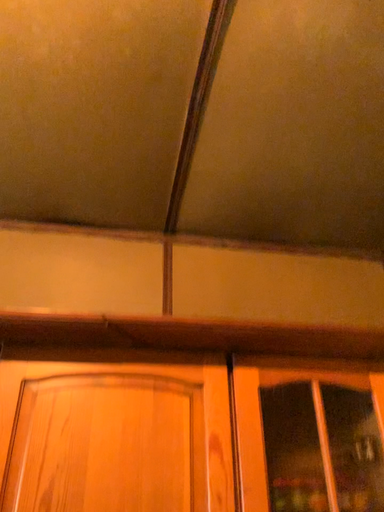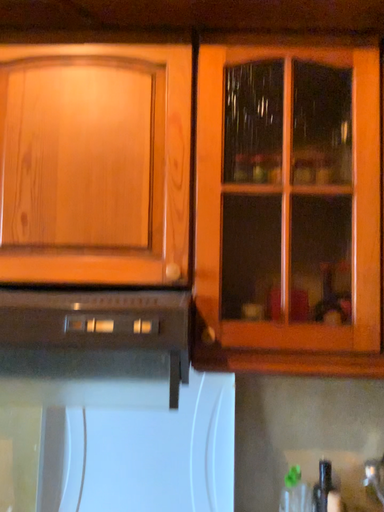
Question: How did the camera likely rotate when shooting the video?

Choices:
 (A) rotated downward
 (B) rotated upward

Answer: (A)